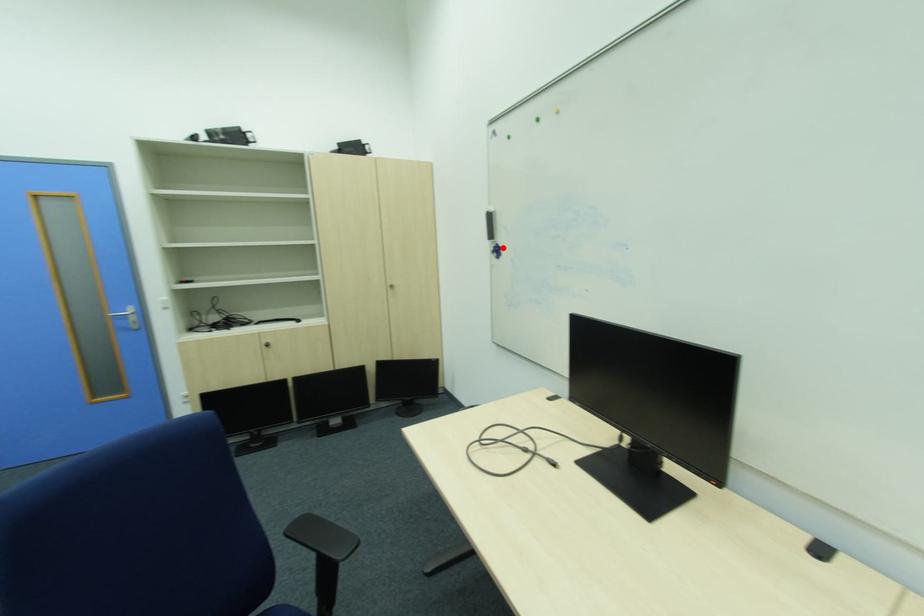
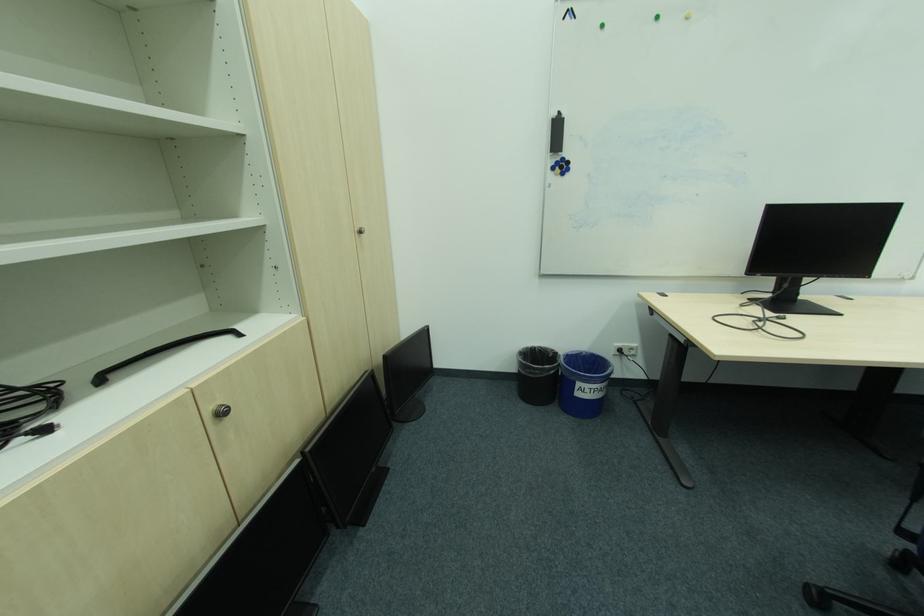
Where in the second image is the point corresponding to the highlighted location from the first image?

(565, 163)